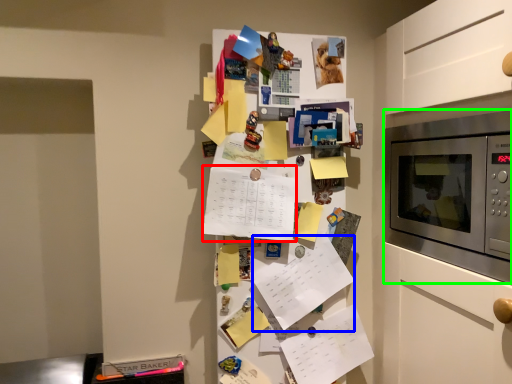
Question: Based on their relative distances, which object is nearer to list (highlighted by a red box)? Choose from list (highlighted by a blue box) and microwave oven (highlighted by a green box).

Choices:
 (A) list
 (B) microwave oven

Answer: (A)